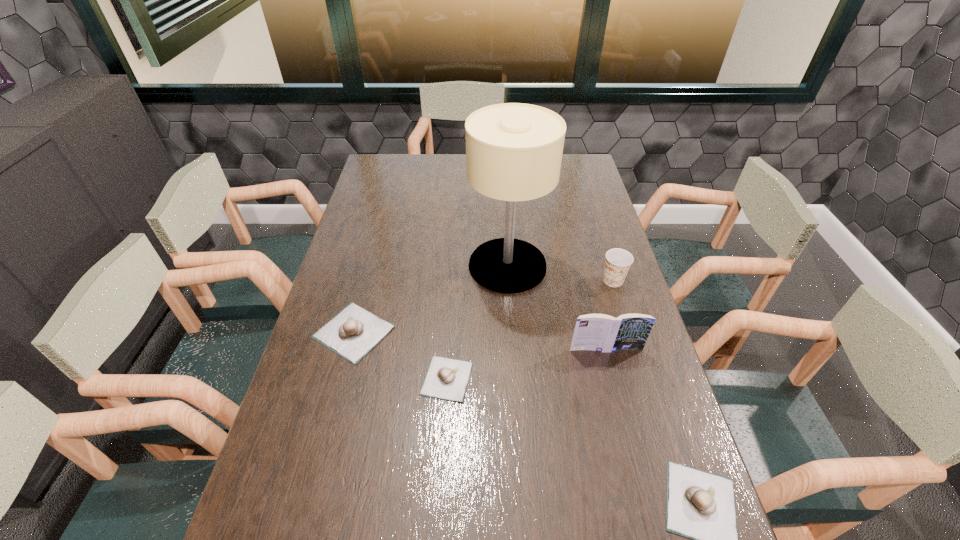
At what (x,y) coordinates should I click in order to perform the action: click on free space between the leftmost object and the tallest object. Please return your answer as a coordinate pair (x, y). Looking at the image, I should click on pyautogui.click(x=430, y=299).

You are a GUI agent. You are given a task and a screenshot of the screen. Output one action in this format:
    pyautogui.click(x=<x>, y=<y>)
    Task: Click on the vacant space that is in between the leftmost garlic and the table lamp
    
    Given the screenshot: What is the action you would take?
    pyautogui.click(x=430, y=299)

Image resolution: width=960 pixels, height=540 pixels. In order to click on vacant area between the leftmost object and the table lamp in this screenshot , I will do `click(430, 299)`.

This screenshot has height=540, width=960. I want to click on object that stands as the fifth closest to the second tallest object, so click(x=353, y=332).

Select which object is the third closest to the table lamp. Please provide its 2D coordinates. Your answer should be formatted as a tuple, i.e. [(x, y)], where the tuple contains the x and y coordinates of a point satisfying the conditions above.

[(353, 332)]

Find the location of a particular element. garlic that can be found as the closest to the leftmost garlic is located at coordinates (446, 378).

Where is `garlic that is the second closest to the second tallest object`? The height and width of the screenshot is (540, 960). garlic that is the second closest to the second tallest object is located at coordinates (700, 505).

Find the location of `vacant point that satisfies the following two spatial constraints: 1. on the front side of the Dixie cup; 2. on the right side of the table lamp`. vacant point that satisfies the following two spatial constraints: 1. on the front side of the Dixie cup; 2. on the right side of the table lamp is located at coordinates (509, 280).